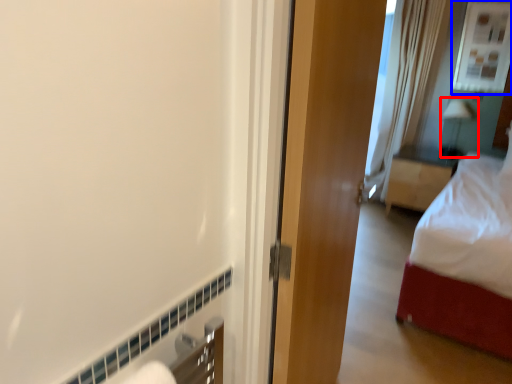
Question: Among these objects, which one is nearest to the camera, lamp (highlighted by a red box) or window (highlighted by a blue box)?

Choices:
 (A) lamp
 (B) window

Answer: (B)